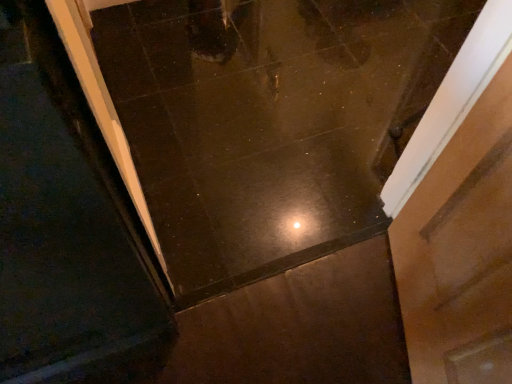
The image size is (512, 384). Identify the location of free point to the right of smooth white door at left. pos(191,351).